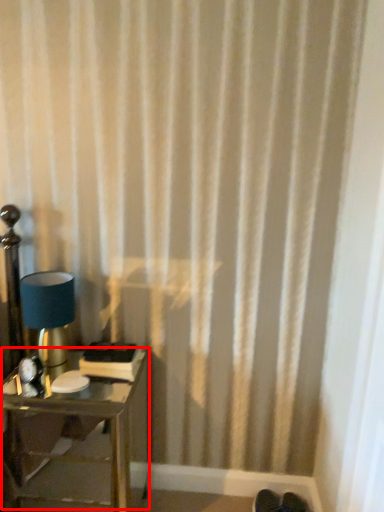
Question: Considering the relative positions of table (annotated by the red box) and lamp in the image provided, where is table (annotated by the red box) located with respect to the staircase?

Choices:
 (A) right
 (B) left

Answer: (A)